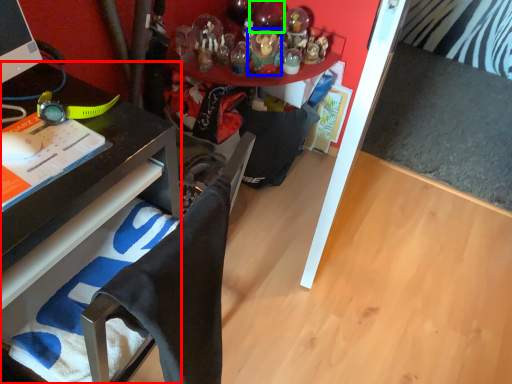
Question: Which object is positioned farthest from desk (highlighted by a red box)? Select from toy (highlighted by a blue box) and toy (highlighted by a green box).

Choices:
 (A) toy
 (B) toy

Answer: (B)